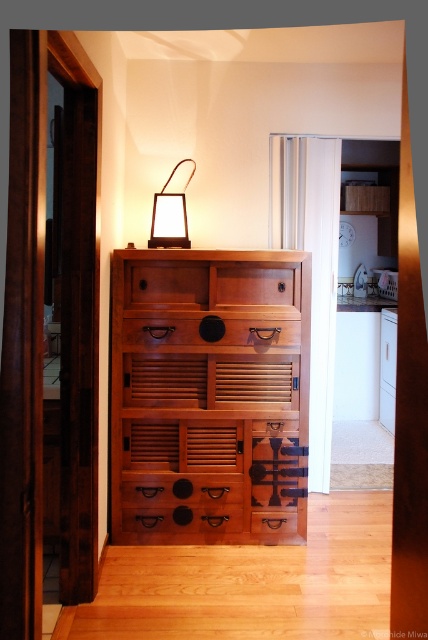
Question: Which object is the farthest from the wooden drawer at center?

Choices:
 (A) wooden dresser at center
 (B) brown matte drawer at center
 (C) matte brown drawer at center
 (D) matte black lamp at upper center

Answer: (C)

Question: Which object is positioned farthest from the wooden dresser at center?

Choices:
 (A) wooden drawer at center
 (B) matte black lamp at upper center

Answer: (B)

Question: Among these points, which one is nearest to the camera?

Choices:
 (A) (113, 332)
 (B) (216, 339)

Answer: (B)

Question: Does brown matte drawer at center have a smaller size compared to matte black lamp at upper center?

Choices:
 (A) yes
 (B) no

Answer: (A)

Question: Can you confirm if wooden drawer at center is smaller than brown matte drawer at center?

Choices:
 (A) no
 (B) yes

Answer: (A)

Question: Does wooden dresser at center appear under matte brown drawer at center?

Choices:
 (A) yes
 (B) no

Answer: (B)